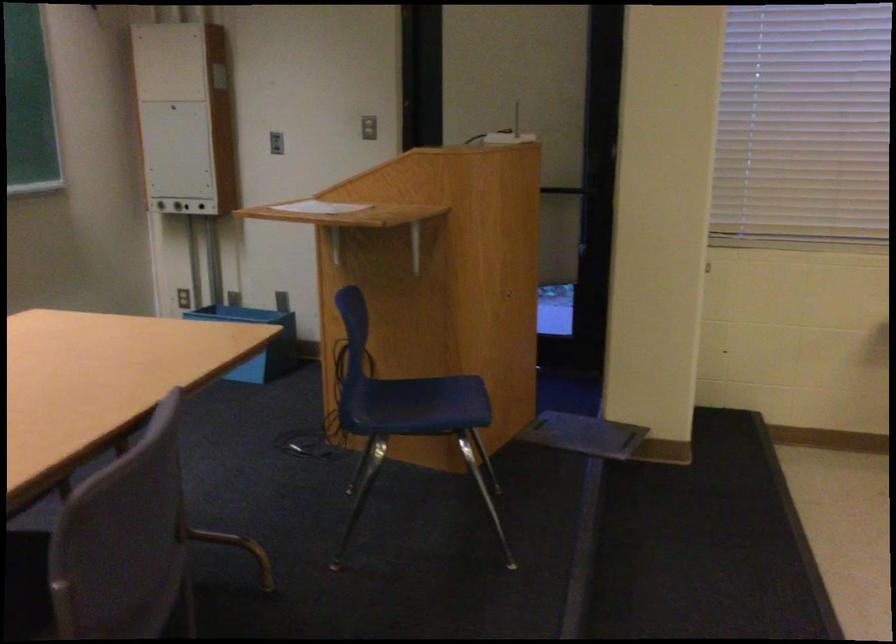
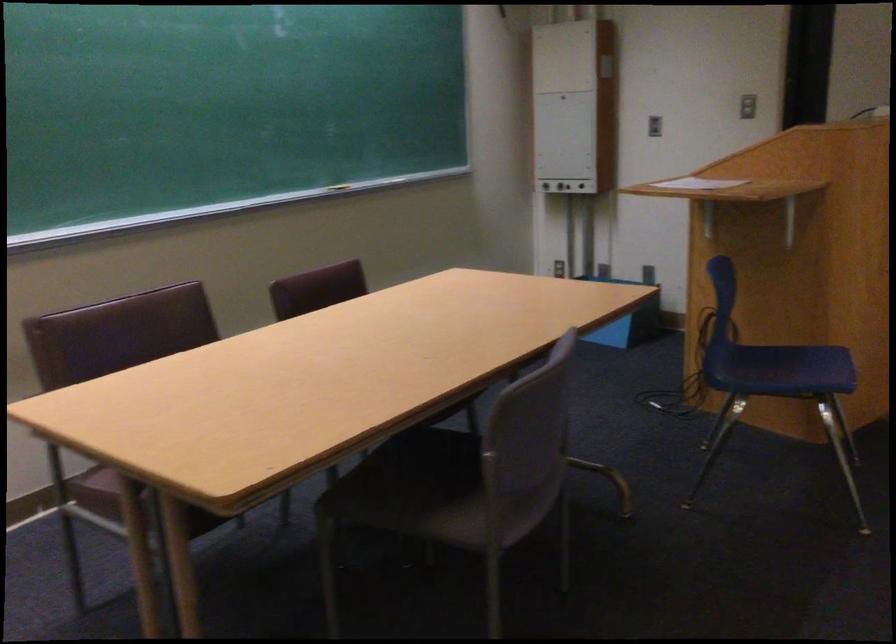
In the second image, find the point that corresponds to (x=278, y=140) in the first image.

(653, 126)